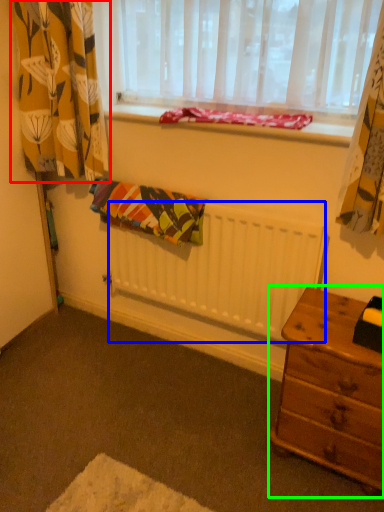
Question: Which object is the farthest from curtain (highlighted by a red box)? Choose among these: radiator (highlighted by a blue box) or nightstand (highlighted by a green box).

Choices:
 (A) radiator
 (B) nightstand

Answer: (B)